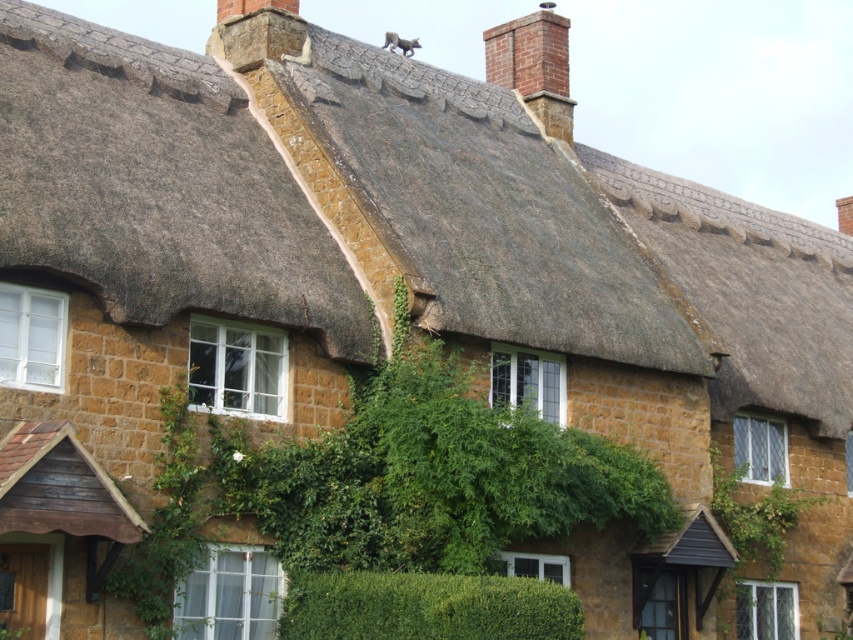
Question: Which point is farther to the camera?

Choices:
 (A) (131, 113)
 (B) (788, 358)
 (C) (556, 595)

Answer: (B)

Question: Which point appears farthest from the camera in this image?

Choices:
 (A) (485, 609)
 (B) (515, 328)
 (C) (190, 269)
 (D) (851, 355)

Answer: (D)

Question: Is brown thatch at center further to camera compared to thatched roof at upper center?

Choices:
 (A) no
 (B) yes

Answer: (A)

Question: Among these objects, which one is nearest to the camera?

Choices:
 (A) thatched roof at upper center
 (B) green leafy hedge at center
 (C) thatched straw roof at upper center

Answer: (B)

Question: Does brown thatch at center have a larger size compared to thatched straw roof at upper center?

Choices:
 (A) no
 (B) yes

Answer: (A)

Question: Is brown thatch at center thinner than thatched roof at upper center?

Choices:
 (A) no
 (B) yes

Answer: (B)